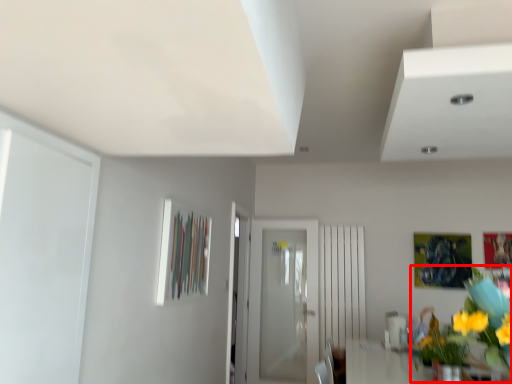
Question: From the image's perspective, what is the correct spatial relationship of floral arrangement (annotated by the red box) in relation to door?

Choices:
 (A) below
 (B) above

Answer: (B)